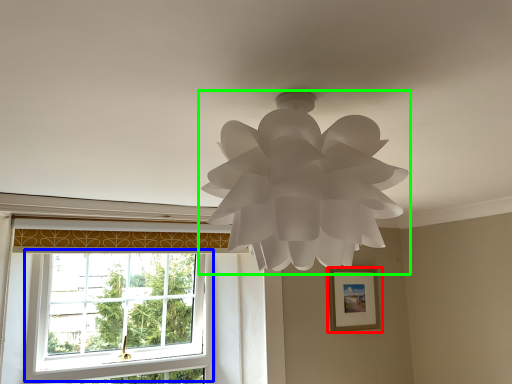
Question: Which object is positioned closest to picture frame (highlighted by a red box)? Select from window (highlighted by a blue box) and lamp (highlighted by a green box).

Choices:
 (A) window
 (B) lamp

Answer: (A)